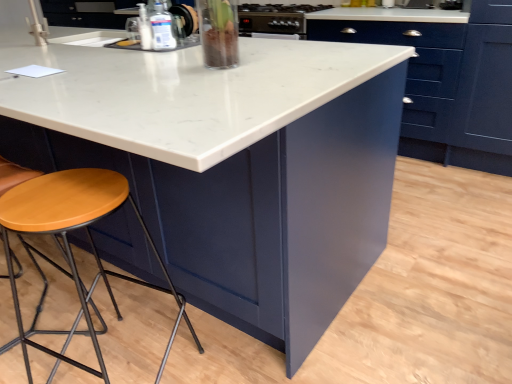
Question: From the image's perspective, relative to wooden seat stool at lower left, is wooden seat at lower left above or below?

Choices:
 (A) above
 (B) below

Answer: (A)

Question: Choose the correct answer: Is wooden seat at lower left inside wooden seat stool at lower left or outside it?

Choices:
 (A) outside
 (B) inside

Answer: (A)

Question: Estimate the real-world distances between objects in this image. Which object is farther from the wooden seat at lower left?

Choices:
 (A) metallic stainless steel oven at upper center, the 2th appliance ordered from the bottom
 (B) clear plastic bottle at upper center
 (C) wooden seat stool at lower left
 (D) clear glass vase at upper center, positioned as the 2th appliance in right-to-left order
 (E) matte blue cabinet at center

Answer: (E)

Question: Which is farther from the clear plastic bottle at upper center?

Choices:
 (A) clear glass vase at upper center, acting as the first appliance starting from the left
 (B) wooden seat at lower left
 (C) wooden seat stool at lower left
 (D) metallic stainless steel oven at upper center, positioned as the 2th appliance in front-to-back order
 (E) matte blue cabinet at center

Answer: (E)